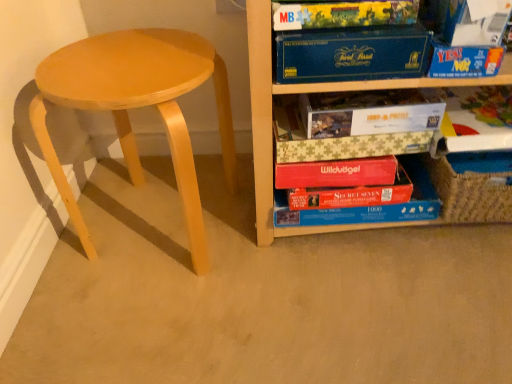
Identify the location of free space in front of wooden puzzle box at right. Image resolution: width=512 pixels, height=384 pixels. (387, 295).